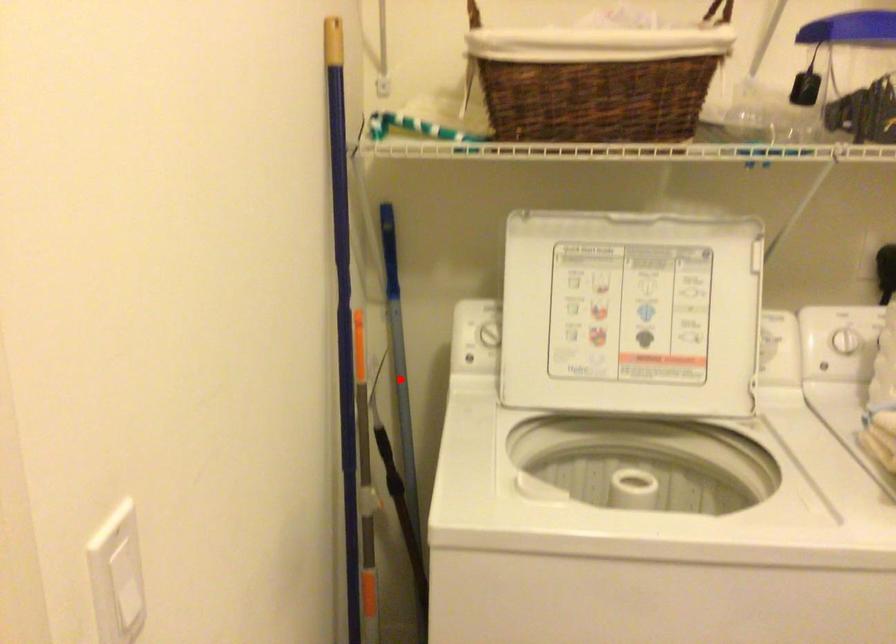
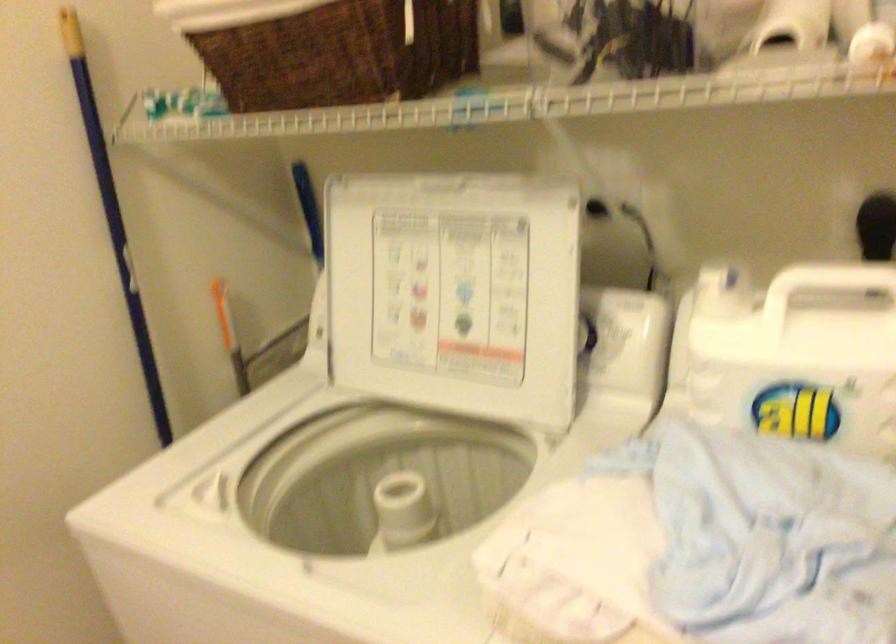
Question: I am providing you with two images of the same scene from different viewpoints. A red point is marked on the first image. Can you still see the location of the red point in image 2?

Choices:
 (A) Yes
 (B) No

Answer: (B)